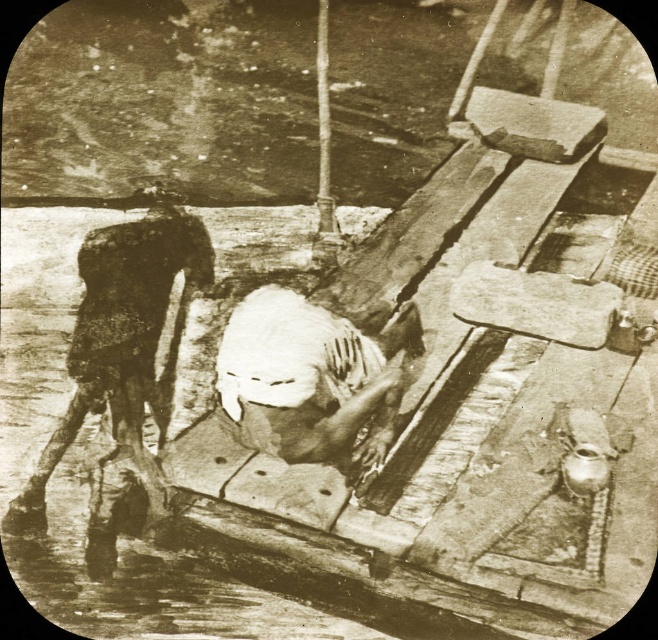
Question: Is rusty metal man at left to the right of white clothed figure at center from the viewer's perspective?

Choices:
 (A) yes
 (B) no

Answer: (B)

Question: Among these points, which one is farthest from the camera?

Choices:
 (A) (265, 323)
 (B) (205, 243)

Answer: (B)

Question: Which point appears farthest from the camera in this image?

Choices:
 (A) (118, 372)
 (B) (361, 406)

Answer: (A)

Question: Is rusty metal man at left thinner than white clothed figure at center?

Choices:
 (A) yes
 (B) no

Answer: (A)

Question: Among these points, which one is nearest to the camera?

Choices:
 (A) (388, 417)
 (B) (84, 240)

Answer: (B)

Question: Can you confirm if rusty metal man at left is positioned above white clothed figure at center?

Choices:
 (A) no
 (B) yes

Answer: (A)